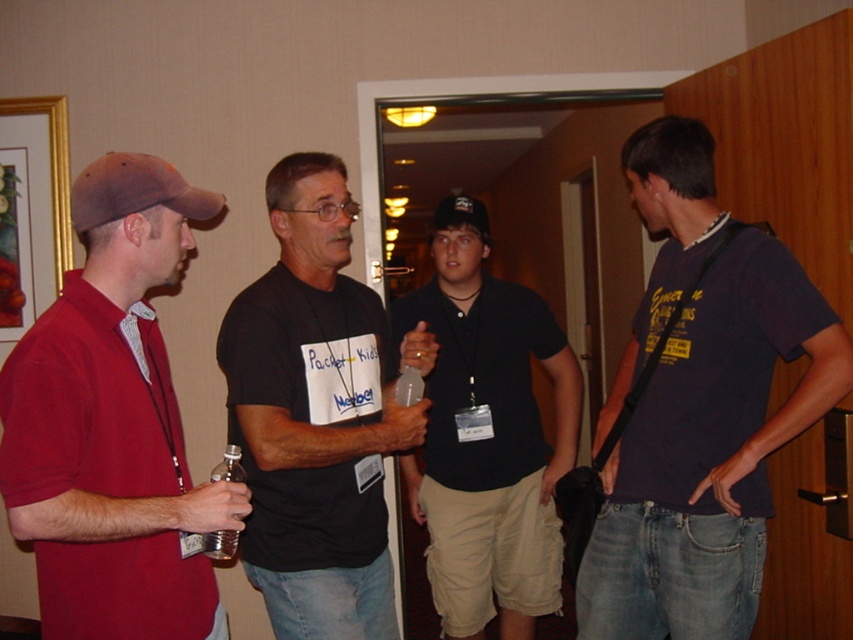
You are standing in the hallway and want to move from point A to point B. Point A is at coordinates point (167, 442) and point B is at coordinates point (235, 531). According to the scene description, which direction should you move to go from point A to point B?

To move from point A to point B, you should move backward because point A is in front of point B.